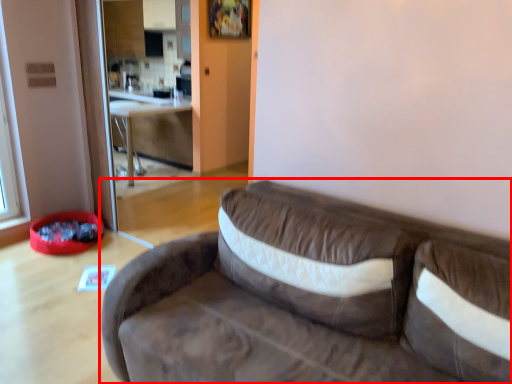
Question: From the image's perspective, where is studio couch (annotated by the red box) located in relation to table in the image?

Choices:
 (A) below
 (B) above

Answer: (A)